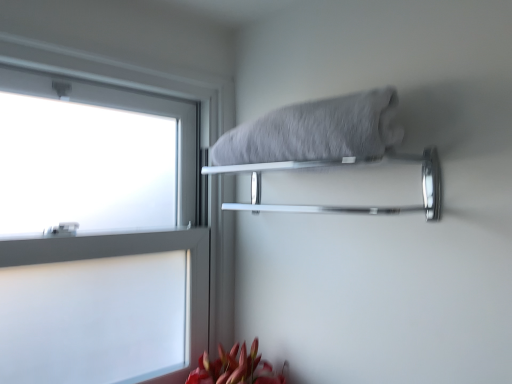
Question: Would you say white frosted glass at left is inside or outside chrome metallic towel bar at upper center?

Choices:
 (A) outside
 (B) inside

Answer: (A)

Question: Based on their positions, is white frosted glass at left located to the left or right of chrome metallic towel bar at upper center?

Choices:
 (A) right
 (B) left

Answer: (B)

Question: Which of these objects is positioned closest to the white frosted glass at left?

Choices:
 (A) gray fluffy towel at upper center
 (B) chrome metallic towel bar at upper center

Answer: (B)

Question: Based on their relative distances, which object is farther from the gray fluffy towel at upper center?

Choices:
 (A) chrome metallic towel bar at upper center
 (B) white frosted glass at left

Answer: (B)